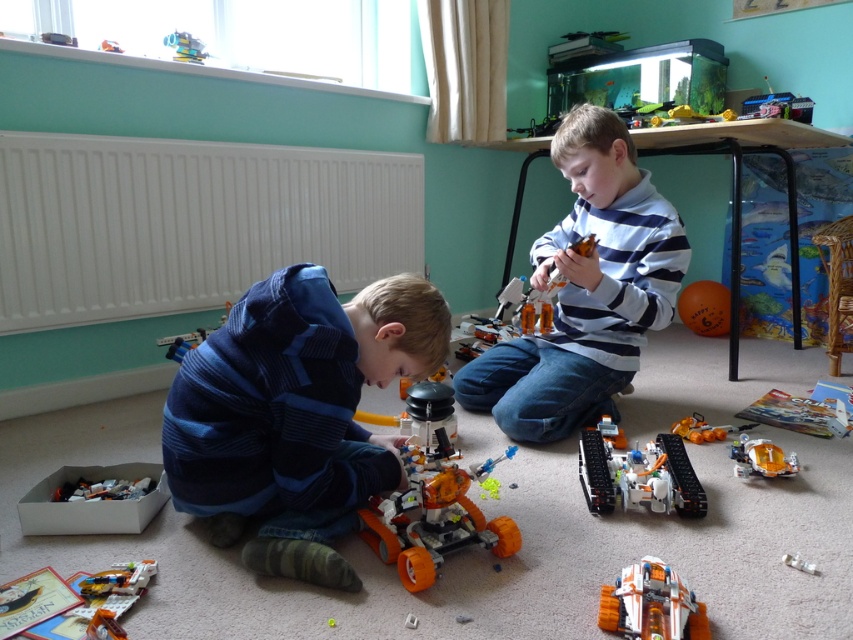
Question: Considering the real-world distances, which object is farthest from the translucent orange plastic pieces at lower left?

Choices:
 (A) white matte radiator at upper left
 (B) blue striped sweater at lower left

Answer: (A)

Question: Can you confirm if striped sweater at center is wider than translucent orange plastic pieces at lower left?

Choices:
 (A) no
 (B) yes

Answer: (B)

Question: Can you confirm if white matte radiator at upper left is positioned to the right of orange matte robot at center?

Choices:
 (A) no
 (B) yes

Answer: (A)

Question: Which object is closer to the camera taking this photo?

Choices:
 (A) orange matte robot at center
 (B) blue striped sweater at lower left
 (C) striped sweater at center

Answer: (A)

Question: Can you confirm if striped sweater at center is positioned below orange matte robot at center?

Choices:
 (A) yes
 (B) no

Answer: (B)

Question: Based on their relative distances, which object is nearer to the orange matte/soft plastic toy at center?

Choices:
 (A) orange matte robot at center
 (B) translucent orange plastic pieces at lower left
 (C) blue striped sweater at lower left

Answer: (A)